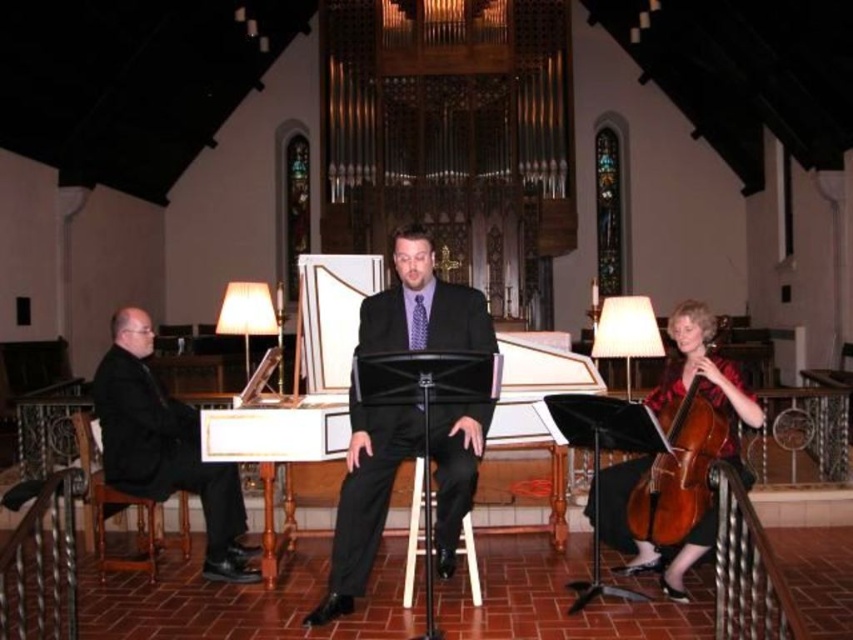
You are a stagehand preparing to move the brown wooden cello at lower right and the brown wooden chair at left. Based on their positions, which object is closer to the front of the stage?

The brown wooden cello at lower right is located above the brown wooden chair at left, meaning it is closer to the front of the stage.

You are a stagehand setting up a 3.5 meter long banner that needs to be placed between the brown wooden cello at lower right and the brown wooden chair at left. Based on the scene description, will the banner fit perfectly between them without overlapping either object?

The brown wooden cello at lower right and brown wooden chair at left are 3.38 meters apart. Since the banner is 3.5 meters long, it is slightly longer than the distance between them. Therefore, the banner will not fit perfectly and will overlap both objects by 0.12 meters.

You are an event planner arranging seating for an audience member who needs to sit between the black matte suit at left and the wooden stool at center. Based on their sizes, which object should the audience member sit closer to?

The audience member should sit closer to the wooden stool at center because the black matte suit at left is larger in size than the wooden stool at center, meaning the stool takes up less space and allows for closer proximity.